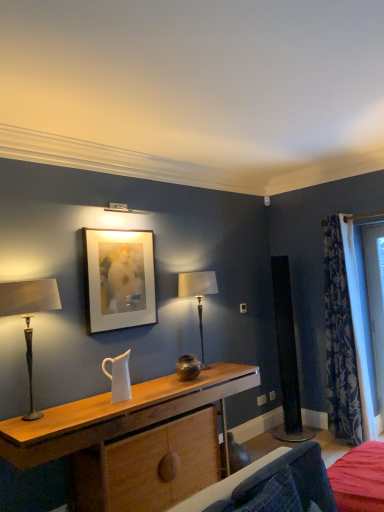
Where is `vacant area to the right of matte bronze table lamp at left, arranged as the first table lamp when viewed from the front`? vacant area to the right of matte bronze table lamp at left, arranged as the first table lamp when viewed from the front is located at coordinates (76, 416).